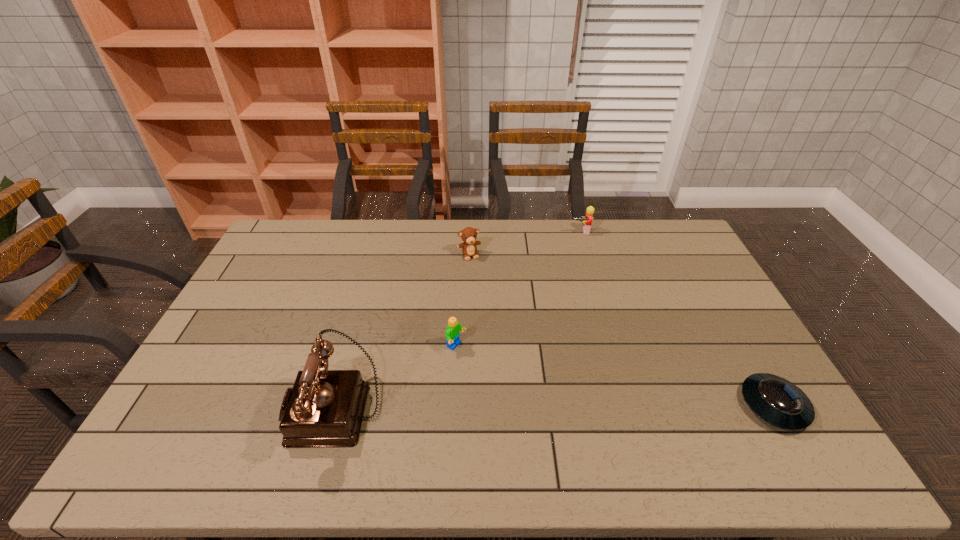
At what (x,y) coordinates should I click in order to perform the action: click on vacant space on the desktop that is between the leftmost object and the saucer and is positioned on the face of the fourth nearest object. Please return your answer as a coordinate pair (x, y). This screenshot has height=540, width=960. Looking at the image, I should click on (531, 407).

Find the location of a particular element. The image size is (960, 540). vacant space on the desktop that is between the leftmost object and the shortest object and is positioned on the face of the third nearest object is located at coordinates (555, 407).

Where is `vacant space on the desktop that is between the leftmost object and the saucer and is positioned in front of the farther Lego with the accessory visible`? The width and height of the screenshot is (960, 540). vacant space on the desktop that is between the leftmost object and the saucer and is positioned in front of the farther Lego with the accessory visible is located at coordinates (604, 406).